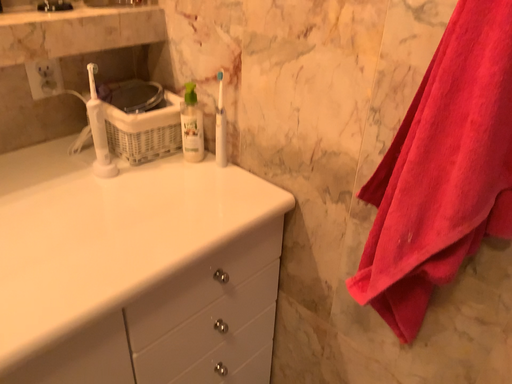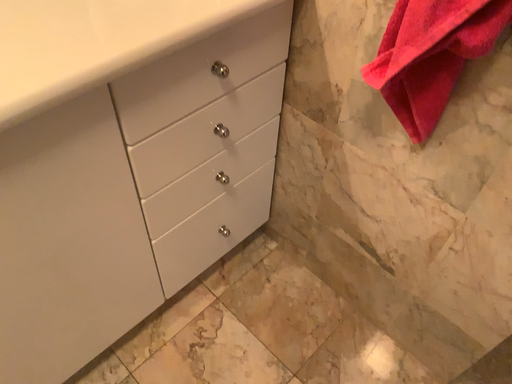
Question: Which way did the camera rotate in the video?

Choices:
 (A) rotated downward
 (B) rotated upward

Answer: (A)